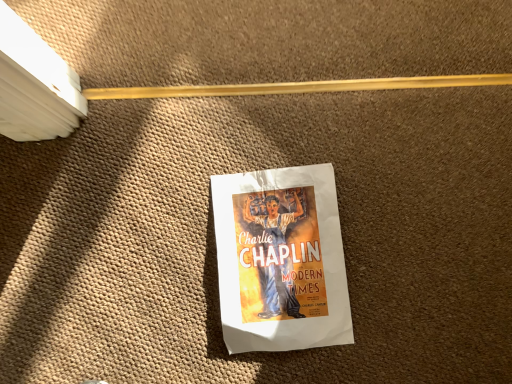
Locate an element on the screen. This screenshot has width=512, height=384. vacant space in white paper poster at center (from a real-world perspective) is located at coordinates (282, 254).